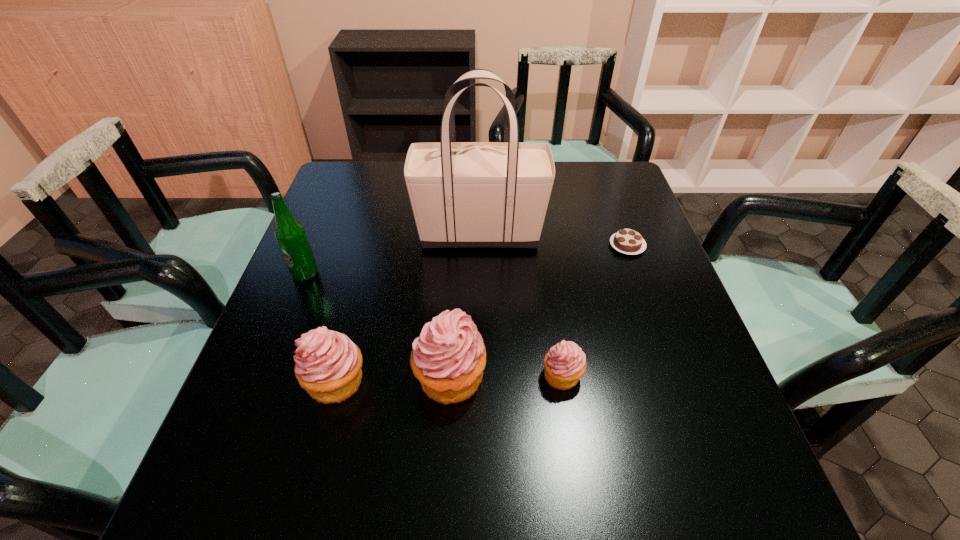
You are a GUI agent. You are given a task and a screenshot of the screen. Output one action in this format:
    pyautogui.click(x=<x>, y=<y>)
    Task: Click on the vacant position in the image that satisfies the following two spatial constraints: 1. with handles facing forward on the rightmost cupcake; 2. on the left side of the tallest object
    
    Given the screenshot: What is the action you would take?
    pyautogui.click(x=479, y=375)

Where is `vacant region that satisfies the following two spatial constraints: 1. with handles facing forward on the tallest object; 2. on the back side of the rightmost cupcake`? Image resolution: width=960 pixels, height=540 pixels. vacant region that satisfies the following two spatial constraints: 1. with handles facing forward on the tallest object; 2. on the back side of the rightmost cupcake is located at coordinates (479, 375).

I want to click on free space that satisfies the following two spatial constraints: 1. on the back side of the shortest cupcake; 2. on the right side of the second cupcake from right to left, so click(x=450, y=375).

The image size is (960, 540). Find the location of `free space that satisfies the following two spatial constraints: 1. with handles facing forward on the shopping bag; 2. on the label of the beer bottle`. free space that satisfies the following two spatial constraints: 1. with handles facing forward on the shopping bag; 2. on the label of the beer bottle is located at coordinates tap(480, 274).